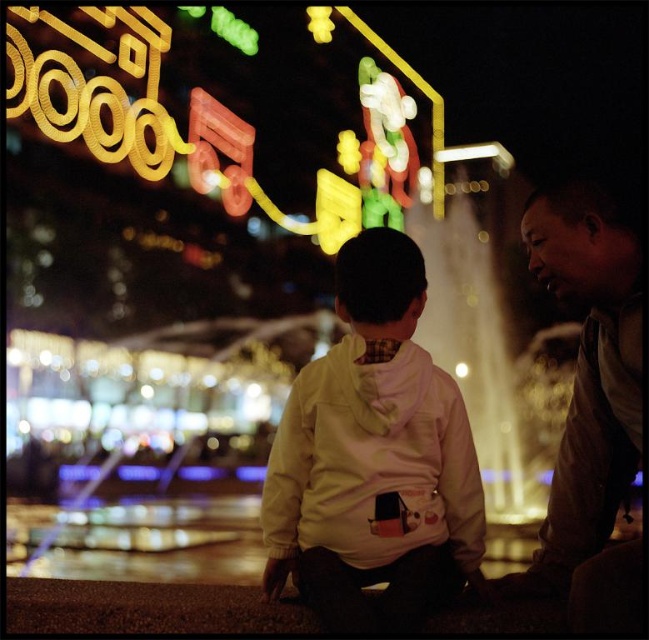
Question: Which point is closer to the camera?

Choices:
 (A) (628, 477)
 (B) (367, 368)

Answer: (B)

Question: Can you confirm if white fleece jacket at center is bigger than brown leather jacket at right?

Choices:
 (A) no
 (B) yes

Answer: (A)

Question: Which of the following is the farthest from the observer?

Choices:
 (A) white fleece jacket at center
 (B) brown leather jacket at right

Answer: (A)

Question: From the image, what is the correct spatial relationship of white fleece jacket at center in relation to brown leather jacket at right?

Choices:
 (A) left
 (B) right

Answer: (A)

Question: Does white fleece jacket at center appear over brown leather jacket at right?

Choices:
 (A) yes
 (B) no

Answer: (B)